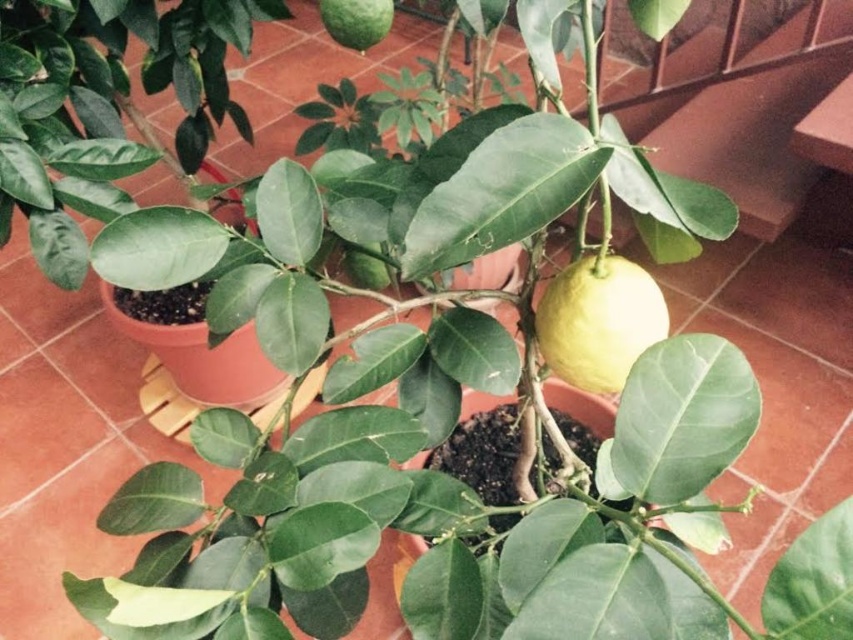
You are standing in front of the potted lemon tree and notice two points marked on the image. The first point is at coordinates point [648,316] and the second point is at point [370,36]. Which point is closer to you?

Point [648,316] is in front of point [370,36], so the first point is closer to you.

You are trying to decide which fruit to pick first between the yellow matte lemon at center and the green matte lime at upper center. Based on their sizes, which one do you think is wider?

The yellow matte lemon at center might be wider than the green matte lime at upper center according to the description.